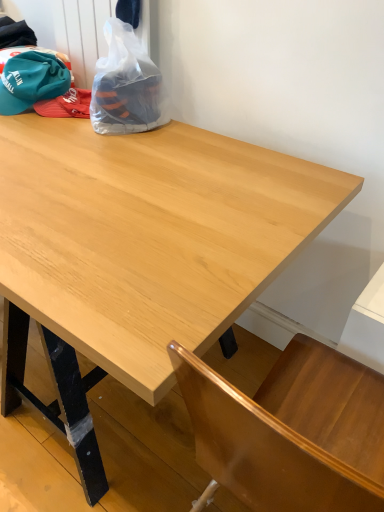
Question: Is transparent plastic bag at upper left beside light wood table at center?

Choices:
 (A) yes
 (B) no

Answer: (B)

Question: Is the depth of transparent plastic bag at upper left less than that of light wood table at center?

Choices:
 (A) no
 (B) yes

Answer: (A)

Question: Considering the relative sizes of transparent plastic bag at upper left and light wood table at center in the image provided, is transparent plastic bag at upper left shorter than light wood table at center?

Choices:
 (A) yes
 (B) no

Answer: (A)

Question: Does transparent plastic bag at upper left have a smaller size compared to light wood table at center?

Choices:
 (A) no
 (B) yes

Answer: (B)

Question: Is transparent plastic bag at upper left not near light wood table at center?

Choices:
 (A) yes
 (B) no

Answer: (B)

Question: Can you confirm if transparent plastic bag at upper left is positioned to the left of light wood table at center?

Choices:
 (A) no
 (B) yes

Answer: (B)

Question: Can you confirm if transparent plastic bag at upper left is taller than teal fabric baseball hat at upper left?

Choices:
 (A) yes
 (B) no

Answer: (A)

Question: From a real-world perspective, is transparent plastic bag at upper left on top of teal fabric baseball hat at upper left?

Choices:
 (A) yes
 (B) no

Answer: (A)

Question: Is teal fabric baseball hat at upper left a part of transparent plastic bag at upper left?

Choices:
 (A) no
 (B) yes

Answer: (A)

Question: From a real-world perspective, is transparent plastic bag at upper left located beneath teal fabric baseball hat at upper left?

Choices:
 (A) no
 (B) yes

Answer: (A)

Question: From the image's perspective, is transparent plastic bag at upper left below teal fabric baseball hat at upper left?

Choices:
 (A) no
 (B) yes

Answer: (B)

Question: Is transparent plastic bag at upper left to the left of teal fabric baseball hat at upper left from the viewer's perspective?

Choices:
 (A) no
 (B) yes

Answer: (A)

Question: Does light wood table at center have a greater height compared to teal fabric baseball hat at upper left?

Choices:
 (A) yes
 (B) no

Answer: (A)